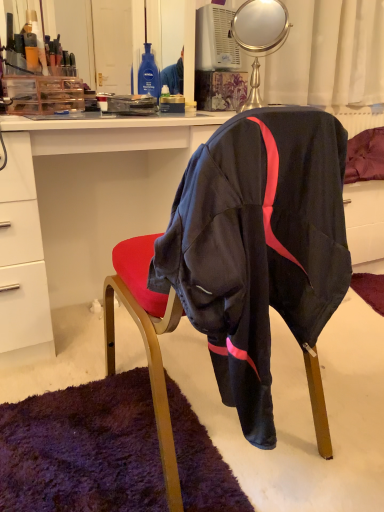
Question: In the image, is metallic gold mirror at upper center on the left side or the right side of white glossy desk at center?

Choices:
 (A) left
 (B) right

Answer: (B)

Question: From the image's perspective, is metallic gold mirror at upper center positioned above or below white glossy desk at center?

Choices:
 (A) below
 (B) above

Answer: (B)

Question: Based on their relative distances, which object is nearer to the metallic gold mirror at upper center?

Choices:
 (A) white glossy desk at center
 (B) black fabric chair at center

Answer: (A)

Question: Estimate the real-world distances between objects in this image. Which object is farther from the black fabric chair at center?

Choices:
 (A) white glossy desk at center
 (B) metallic gold mirror at upper center

Answer: (B)